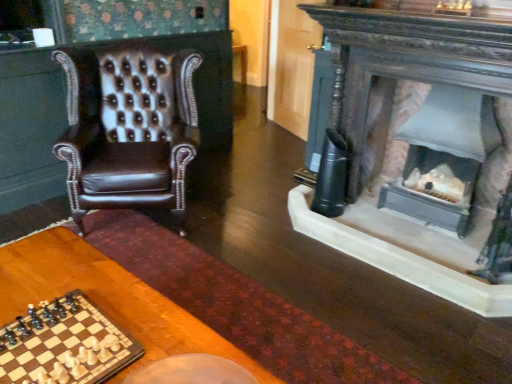
Image resolution: width=512 pixels, height=384 pixels. I want to click on vacant space to the right of brown leather chair at left, so click(x=231, y=225).